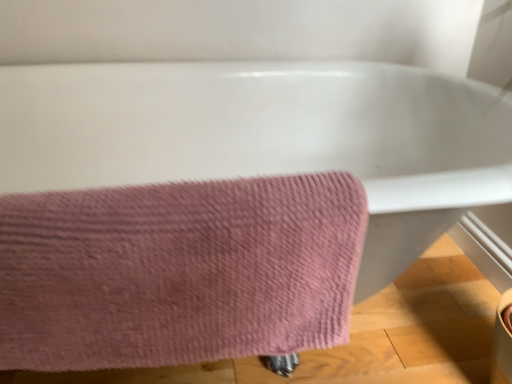
What do you see at coordinates (268, 137) in the screenshot? The image size is (512, 384). I see `white glossy bathtub at upper center` at bounding box center [268, 137].

This screenshot has height=384, width=512. What are the coordinates of `white glossy bathtub at upper center` in the screenshot? It's located at (268, 137).

The height and width of the screenshot is (384, 512). Identify the location of pink textured towel at lower left. (178, 271).

What do you see at coordinates (178, 271) in the screenshot? This screenshot has width=512, height=384. I see `pink textured towel at lower left` at bounding box center [178, 271].

Locate an element on the screen. white glossy bathtub at upper center is located at coordinates (268, 137).

Which object is positioned more to the left, pink textured towel at lower left or white glossy bathtub at upper center?

From the viewer's perspective, pink textured towel at lower left appears more on the left side.

Considering the positions of objects pink textured towel at lower left and white glossy bathtub at upper center in the image provided, who is behind, pink textured towel at lower left or white glossy bathtub at upper center?

Positioned behind is pink textured towel at lower left.

Is point (64, 282) farther from camera compared to point (256, 140)?

No, it is not.

From the image's perspective, does pink textured towel at lower left appear higher than white glossy bathtub at upper center?

Actually, pink textured towel at lower left appears below white glossy bathtub at upper center in the image.

From a real-world perspective, does pink textured towel at lower left stand above white glossy bathtub at upper center?

Indeed, from a real-world perspective, pink textured towel at lower left stands above white glossy bathtub at upper center.

Does pink textured towel at lower left have a lesser width compared to white glossy bathtub at upper center?

Correct, the width of pink textured towel at lower left is less than that of white glossy bathtub at upper center.

Which of these two, pink textured towel at lower left or white glossy bathtub at upper center, stands taller?

white glossy bathtub at upper center is taller.

Considering the sizes of objects pink textured towel at lower left and white glossy bathtub at upper center in the image provided, who is smaller, pink textured towel at lower left or white glossy bathtub at upper center?

pink textured towel at lower left.

Would you say pink textured towel at lower left is outside white glossy bathtub at upper center?

No, pink textured towel at lower left is not outside of white glossy bathtub at upper center.

Are pink textured towel at lower left and white glossy bathtub at upper center beside each other?

No, pink textured towel at lower left is not with white glossy bathtub at upper center.

Is pink textured towel at lower left positioned with its back to white glossy bathtub at upper center?

Yes, pink textured towel at lower left is facing away from white glossy bathtub at upper center.

How many degrees apart are the facing directions of pink textured towel at lower left and white glossy bathtub at upper center?

pink textured towel at lower left and white glossy bathtub at upper center are facing 0.822 degrees away from each other.

Measure the distance between pink textured towel at lower left and white glossy bathtub at upper center.

pink textured towel at lower left is 23.72 inches away from white glossy bathtub at upper center.

Identify the location of bathtub in front of the pink textured towel at lower left. (268, 137).

Based on the photo, based on their positions, is white glossy bathtub at upper center located to the left or right of pink textured towel at lower left?

white glossy bathtub at upper center is to the right of pink textured towel at lower left.

Which object is further away from the camera, white glossy bathtub at upper center or pink textured towel at lower left?

pink textured towel at lower left is further from the camera.

Is point (190, 178) closer to viewer compared to point (35, 307)?

No, (190, 178) is behind (35, 307).

Consider the image. From the image's perspective, which object appears higher, white glossy bathtub at upper center or pink textured towel at lower left?

white glossy bathtub at upper center appears higher in the image.

From a real-world perspective, is white glossy bathtub at upper center physically located above or below pink textured towel at lower left?

white glossy bathtub at upper center is situated lower than pink textured towel at lower left in the real world.

Consider the image. Can you confirm if white glossy bathtub at upper center is wider than pink textured towel at lower left?

Yes, white glossy bathtub at upper center is wider than pink textured towel at lower left.

Which of these two, white glossy bathtub at upper center or pink textured towel at lower left, stands taller?

Standing taller between the two is white glossy bathtub at upper center.

Does white glossy bathtub at upper center have a larger size compared to pink textured towel at lower left?

Yes, white glossy bathtub at upper center is bigger than pink textured towel at lower left.

Would you say white glossy bathtub at upper center contains pink textured towel at lower left?

Yes, white glossy bathtub at upper center is surrounding pink textured towel at lower left.

Are white glossy bathtub at upper center and pink textured towel at lower left far apart?

No, there isn't a large distance between white glossy bathtub at upper center and pink textured towel at lower left.

Could you tell me if white glossy bathtub at upper center is facing pink textured towel at lower left?

Yes, white glossy bathtub at upper center is turned towards pink textured towel at lower left.

Locate an element on the screen. The width and height of the screenshot is (512, 384). bathtub to the right of pink textured towel at lower left is located at coordinates (268, 137).

Where is `towel above the white glossy bathtub at upper center (from a real-world perspective)`? This screenshot has height=384, width=512. towel above the white glossy bathtub at upper center (from a real-world perspective) is located at coordinates (178, 271).

I want to click on bathtub in front of the pink textured towel at lower left, so click(x=268, y=137).